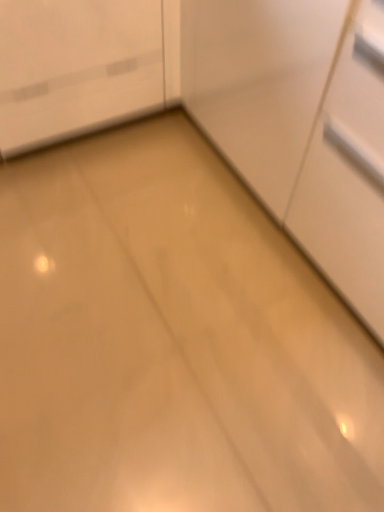
Locate an element on the screen. The image size is (384, 512). vacant area situated below white glossy refrigerator at upper left (from a real-world perspective) is located at coordinates (88, 145).